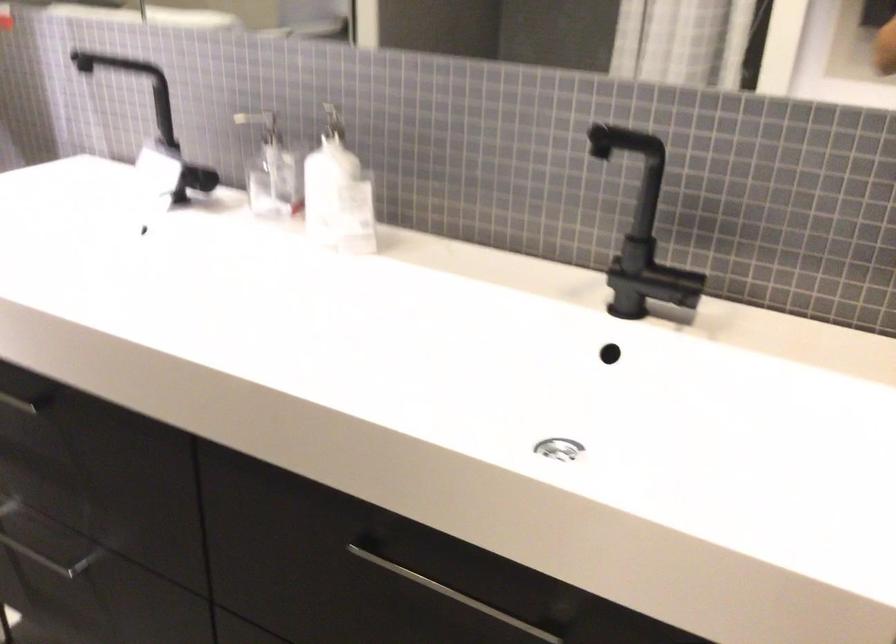
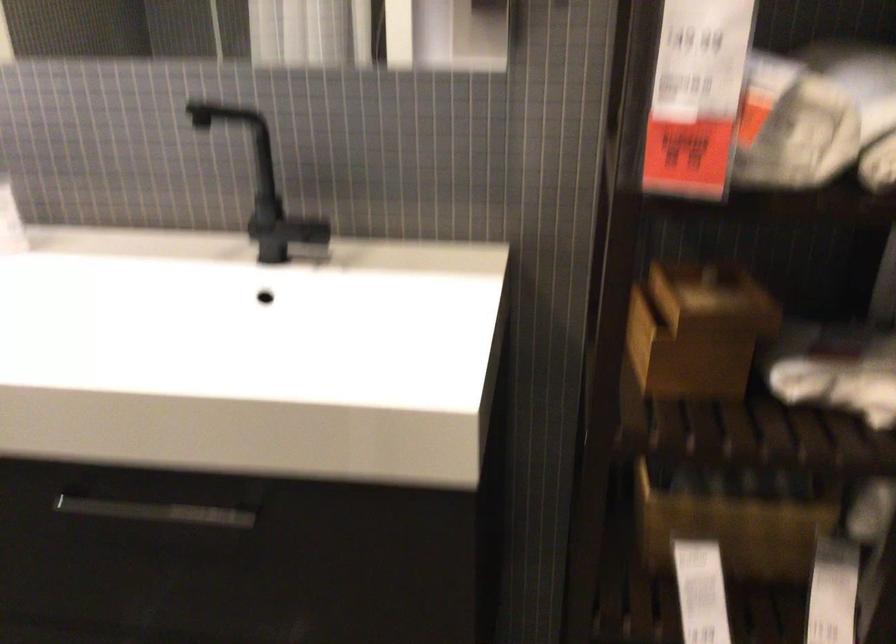
In the second image, find the point that corresponds to (625,272) in the first image.

(268, 227)